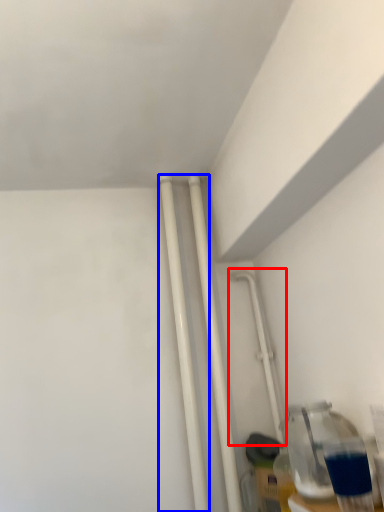
Question: Which object is further to the camera taking this photo, water pipe (highlighted by a red box) or pipe (highlighted by a blue box)?

Choices:
 (A) water pipe
 (B) pipe

Answer: (A)